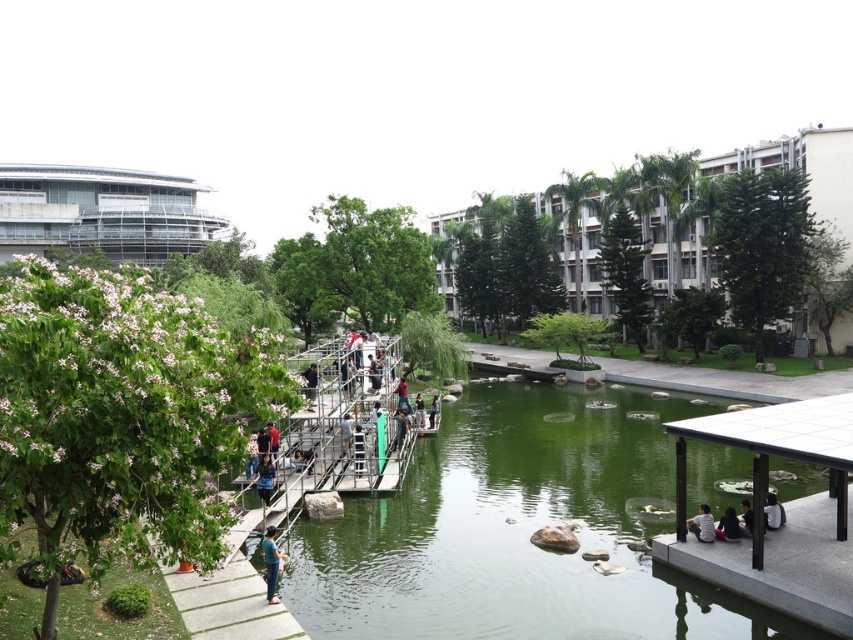
Question: Is smooth concrete dock at lower right bigger than dark blue jeans at center?

Choices:
 (A) yes
 (B) no

Answer: (A)

Question: Does dark blue jeans at lower right have a lesser width compared to dark gray fabric shirt at lower right?

Choices:
 (A) no
 (B) yes

Answer: (A)

Question: Which point appears farthest from the camera in this image?

Choices:
 (A) click(781, 513)
 (B) click(732, 518)
 (C) click(836, 600)
 (D) click(265, 547)

Answer: (A)

Question: Which point is closer to the camera?

Choices:
 (A) (772, 506)
 (B) (717, 572)
 (C) (276, 579)
 (D) (265, 480)

Answer: (C)

Question: From the image, what is the correct spatial relationship of smooth concrete dock at lower right in relation to denim jeans at lower left?

Choices:
 (A) right
 (B) left

Answer: (A)

Question: Which object is positioned farthest from the dark blue jeans at lower right?

Choices:
 (A) dark blue jeans at center
 (B) matte black shirt at center

Answer: (A)